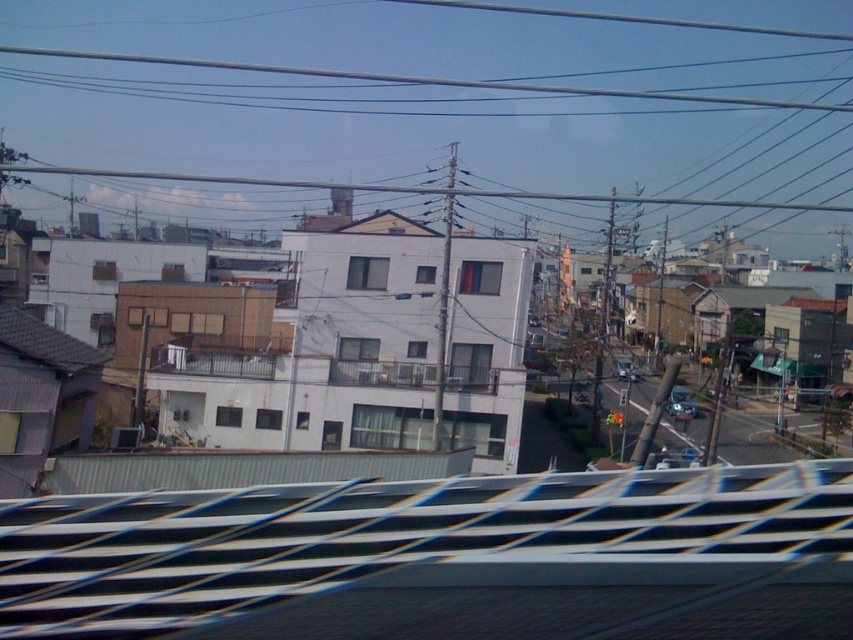
Question: Is metallic wire at upper center to the right of metallic blue sedan at center from the viewer's perspective?

Choices:
 (A) yes
 (B) no

Answer: (B)

Question: Which point is closer to the camera?

Choices:
 (A) (822, 593)
 (B) (642, 148)

Answer: (A)

Question: Can you confirm if metallic wire at upper center is smaller than metallic silver train track at center?

Choices:
 (A) no
 (B) yes

Answer: (A)

Question: Does metallic silver train track at center appear on the left side of metallic blue sedan at center?

Choices:
 (A) yes
 (B) no

Answer: (A)

Question: Which object appears farthest from the camera in this image?

Choices:
 (A) metallic wire at upper center
 (B) metallic silver train track at center
 (C) metallic blue sedan at center

Answer: (A)

Question: Which point is closer to the camera?

Choices:
 (A) click(x=294, y=579)
 (B) click(x=614, y=362)
 (C) click(x=467, y=129)

Answer: (A)